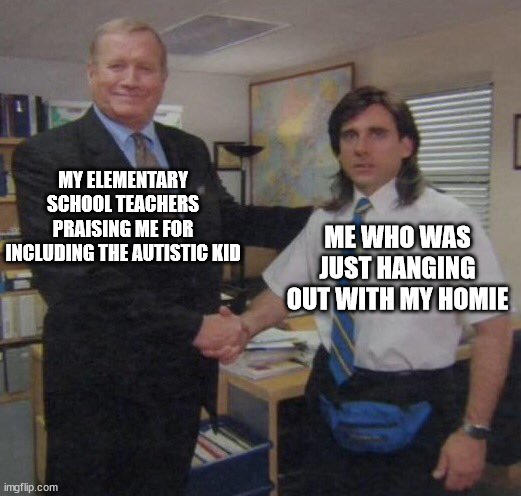
The width and height of the screenshot is (521, 496). What are the coordinates of `under table` in the screenshot? It's located at (286, 436).